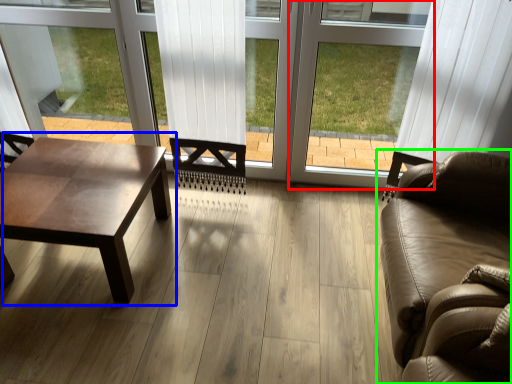
Question: Considering the real-world distances, which object is closest to window frame (highlighted by a red box)? coffee table (highlighted by a blue box) or studio couch (highlighted by a green box).

Choices:
 (A) coffee table
 (B) studio couch

Answer: (B)